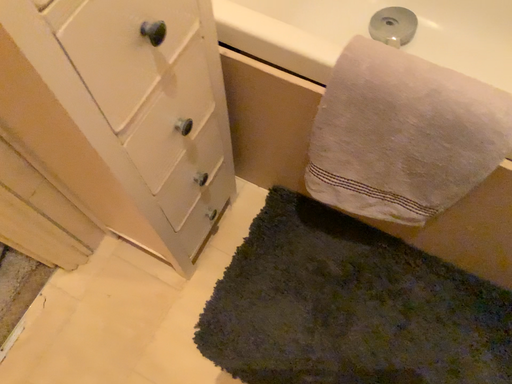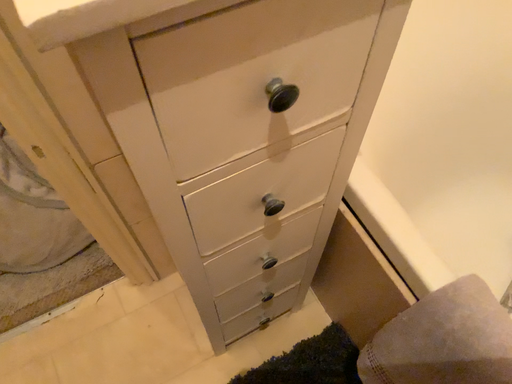
Question: How did the camera likely rotate when shooting the video?

Choices:
 (A) rotated upward
 (B) rotated downward

Answer: (A)